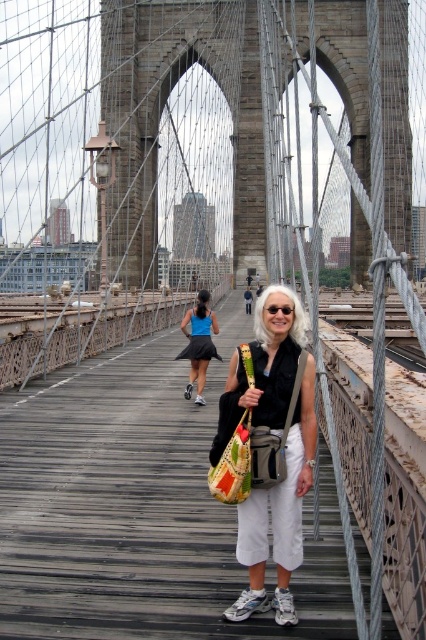
Who is positioned more to the left, white cotton pants at center or black plastic goggles at center?

Positioned to the left is black plastic goggles at center.

Does point (232, 612) come closer to viewer compared to point (285, 314)?

Yes, point (232, 612) is closer to viewer.

The width and height of the screenshot is (426, 640). I want to click on white cotton pants at center, so click(273, 449).

Is blue fabric skirt at center above black plastic goggles at center?

No.

Does blue fabric skirt at center have a greater width compared to black plastic goggles at center?

Yes.

Does point (186, 397) come in front of point (282, 310)?

That is False.

The width and height of the screenshot is (426, 640). What are the coordinates of `blue fabric skirt at center` in the screenshot? It's located at (198, 342).

Is the position of white cotton pants at center more distant than that of blue fabric skirt at center?

No.

Is white cotton pants at center wider than blue fabric skirt at center?

Yes.

Is point (305, 372) closer to camera compared to point (204, 324)?

Yes.

Locate an element on the screen. Image resolution: width=426 pixels, height=640 pixels. white cotton pants at center is located at coordinates (273, 449).